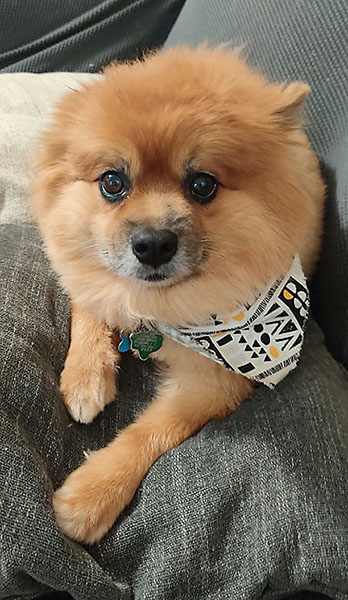
This screenshot has height=600, width=348. What are the coordinates of `crease in fabric` in the screenshot? It's located at (60, 38).